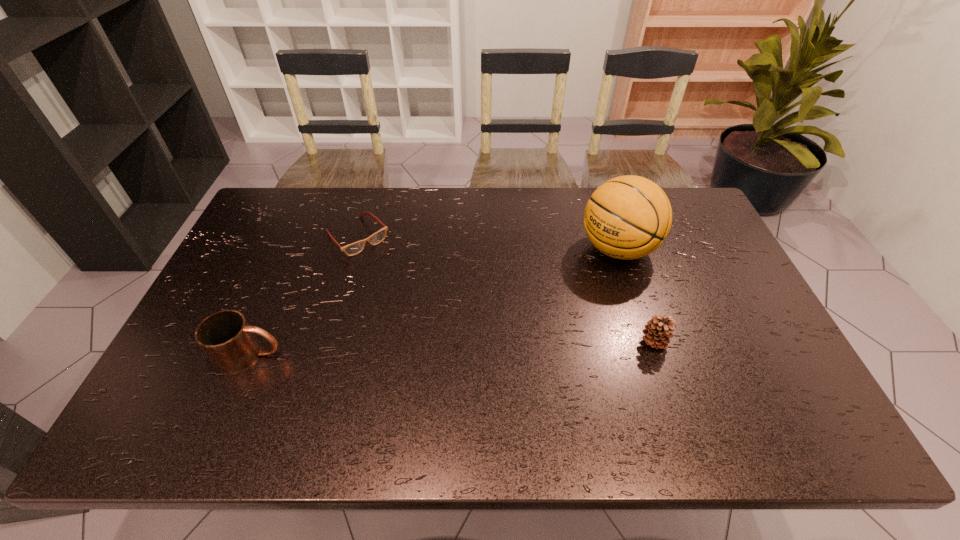
You are a GUI agent. You are given a task and a screenshot of the screen. Output one action in this format:
    pyautogui.click(x=<x>, y=<y>)
    Task: Click on the free region located 0.310m on the surface of the tallest object near the brand logo
    The width and height of the screenshot is (960, 540).
    Given the screenshot: What is the action you would take?
    pyautogui.click(x=516, y=316)

Where is `vacant space positioned on the surface of the tallest object near the brand logo`? The width and height of the screenshot is (960, 540). vacant space positioned on the surface of the tallest object near the brand logo is located at coordinates [541, 299].

I want to click on spectacles positioned at the far edge, so click(355, 248).

This screenshot has width=960, height=540. Find the location of `basketball that is at the far edge`. basketball that is at the far edge is located at coordinates (627, 217).

This screenshot has height=540, width=960. What are the coordinates of `object located at the near edge` in the screenshot? It's located at click(226, 338).

Find the location of a particular element. This screenshot has width=960, height=540. object that is at the left edge is located at coordinates (226, 338).

Locate an element on the screen. The image size is (960, 540). object that is at the near left corner is located at coordinates (226, 338).

In the image, there is a desktop. Where is `vacant space at the far edge`? vacant space at the far edge is located at coordinates (518, 197).

You are a GUI agent. You are given a task and a screenshot of the screen. Output one action in this format:
    pyautogui.click(x=<x>, y=<y>)
    Task: Click on the free space at the near edge of the desktop
    The image size is (960, 540).
    Given the screenshot: What is the action you would take?
    pyautogui.click(x=253, y=396)

Where is `vacant space at the left edge`? Image resolution: width=960 pixels, height=540 pixels. vacant space at the left edge is located at coordinates (255, 232).